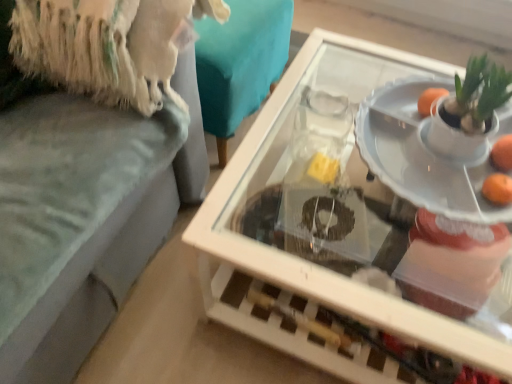
Locate an element on the screen. Image resolution: width=512 pixels, height=384 pixels. vacant space that is to the left of orange matte at right, the 1th orange positioned from the bottom is located at coordinates (428, 176).